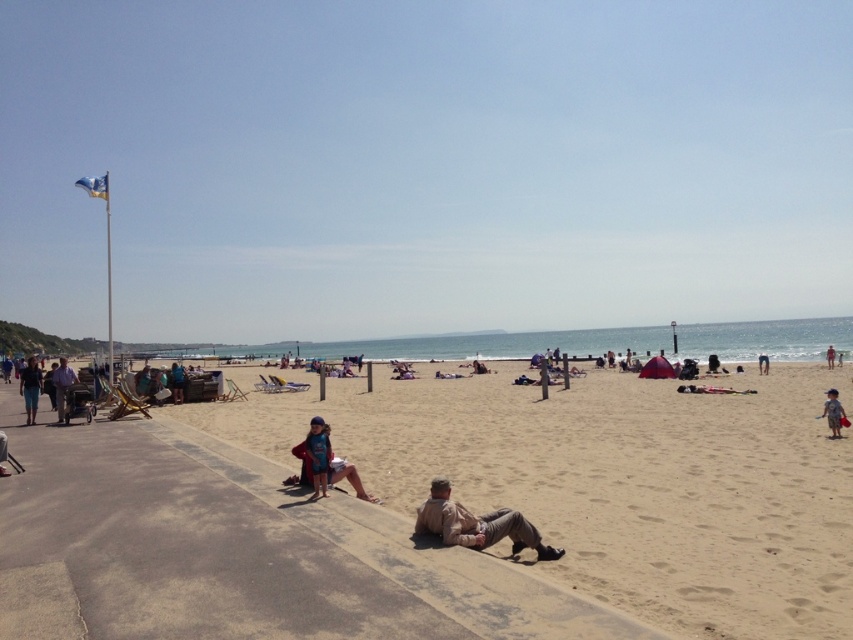
You are a photographer at the beach and want to capture both the matte blue swimsuit at center and the blue denim shorts at left in the same frame. Which object should you focus on first to ensure both are in the frame?

The matte blue swimsuit at center is smaller in size than the blue denim shorts at left, so you should focus on the blue denim shorts at left first to ensure both fit within the frame.

You are a photographer positioned at the edge of the walkway. You want to capture a photo that includes both the matte blue swimsuit at center and the blue denim shorts at left. Based on their sizes, which object should you focus on first to ensure both are in frame?

The matte blue swimsuit at center is thinner than the blue denim shorts at left. To ensure both are in frame, focus on the blue denim shorts at left first since it is wider and might require more space in the composition.